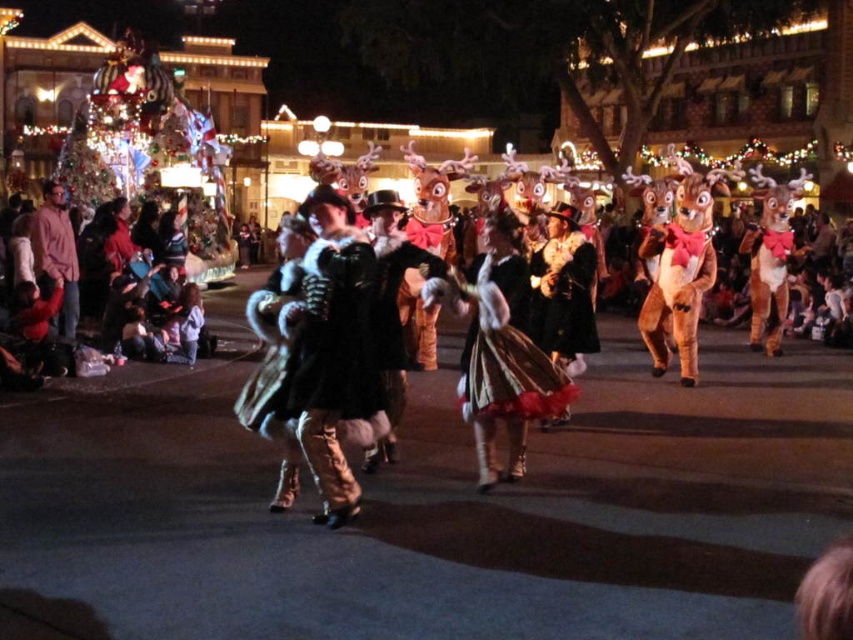
You are standing at the point marked as point (509, 372). You want to throw a confetti ball to the float in the background. The confetti ball has a maximum range of 40 meters. Will it reach the float?

The distance between you and the float is 40.28 meters, which exceeds the confetti ball maximum range of 40 meters. Therefore, the confetti ball will not reach the float.

Consider the image. You are at the parade and want to take a photo of both the brown plush squirrel at right and the dark clothing at left. Which object should you focus on first to capture both in the frame?

The dark clothing at left is to the left of the brown plush squirrel at right, so you should focus on the dark clothing at left first to ensure both are in the frame.

You are a photographer at the front of the stage. You want to take a photo of the velvet gold dress at center and the velvet gold coat at center. Which one will appear larger in the photo?

The velvet gold dress at center will appear larger in the photo because it is closer to the viewer than the velvet gold coat at center.